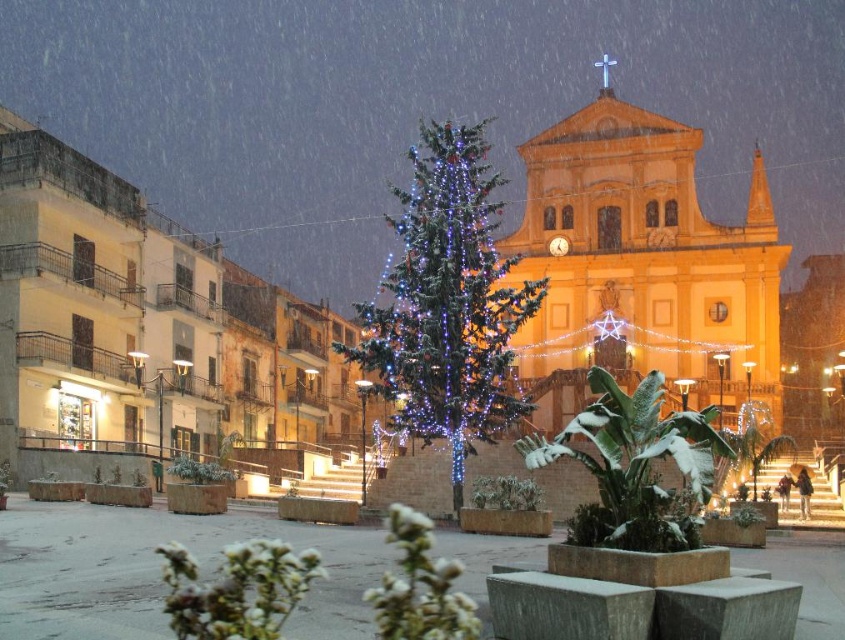
Does illuminated green pine at center have a lesser height compared to white snowy plant at center?

In fact, illuminated green pine at center may be taller than white snowy plant at center.

Is point (412, 234) positioned after point (592, 536)?

That is True.

At what (x,y) coordinates should I click in order to perform the action: click on illuminated green pine at center. Please return your answer as a coordinate pair (x, y). This screenshot has height=640, width=845. Looking at the image, I should click on (446, 301).